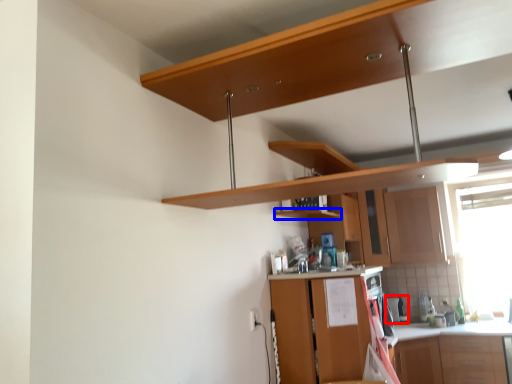
Question: Which object is further to the camera taking this photo, appliance (highlighted by a red box) or shelf (highlighted by a blue box)?

Choices:
 (A) appliance
 (B) shelf

Answer: (A)